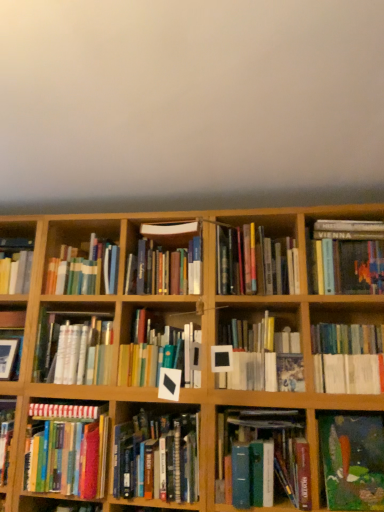
Question: Is hardcover books at center right, acting as the 2th book starting from the right, at the right side of oil painting at lower right, which is the third book in right-to-left order?

Choices:
 (A) yes
 (B) no

Answer: (A)

Question: Does hardcover books at center right, acting as the 2th book starting from the right, have a greater width compared to oil painting at lower right, the 11th book in the left-to-right sequence?

Choices:
 (A) yes
 (B) no

Answer: (A)

Question: Can you confirm if hardcover books at center right, acting as the 2th book starting from the right, is shorter than oil painting at lower right, which is the third book in right-to-left order?

Choices:
 (A) no
 (B) yes

Answer: (A)

Question: Can you confirm if hardcover books at center right, acting as the 2th book starting from the right, is taller than oil painting at lower right, which is the third book in right-to-left order?

Choices:
 (A) yes
 (B) no

Answer: (A)

Question: Considering the relative sizes of hardcover books at center right, the 12th book positioned from the left, and oil painting at lower right, which is the third book in right-to-left order, in the image provided, is hardcover books at center right, the 12th book positioned from the left, smaller than oil painting at lower right, which is the third book in right-to-left order,?

Choices:
 (A) no
 (B) yes

Answer: (A)

Question: Is hardcover books at center right, the 12th book positioned from the left, positioned before oil painting at lower right, the 11th book in the left-to-right sequence?

Choices:
 (A) no
 (B) yes

Answer: (A)

Question: Considering the relative sizes of hardcover book at center-left, the third book from the left, and white matte book at center, arranged as the fifth book when viewed from the right, in the image provided, is hardcover book at center-left, the third book from the left, smaller than white matte book at center, arranged as the fifth book when viewed from the right,?

Choices:
 (A) yes
 (B) no

Answer: (A)

Question: Considering the relative sizes of hardcover book at center-left, the third book from the left, and white matte book at center, arranged as the fifth book when viewed from the right, in the image provided, is hardcover book at center-left, the third book from the left, wider than white matte book at center, arranged as the fifth book when viewed from the right,?

Choices:
 (A) no
 (B) yes

Answer: (B)

Question: From a real-world perspective, is hardcover book at center-left, the third book from the left, located higher than white matte book at center, arranged as the fifth book when viewed from the right?

Choices:
 (A) yes
 (B) no

Answer: (B)

Question: Is hardcover book at center-left, the third book from the left, touching white matte book at center, arranged as the fifth book when viewed from the right?

Choices:
 (A) no
 (B) yes

Answer: (A)

Question: Is hardcover book at center-left, which is the eleventh book in right-to-left order, closer to camera compared to white matte book at center, the ninth book viewed from the left?

Choices:
 (A) no
 (B) yes

Answer: (A)

Question: Considering the relative sizes of hardcover book at center-left, the third book from the left, and white matte book at center, arranged as the fifth book when viewed from the right, in the image provided, is hardcover book at center-left, the third book from the left, taller than white matte book at center, arranged as the fifth book when viewed from the right,?

Choices:
 (A) yes
 (B) no

Answer: (B)

Question: Considering the relative positions of hardcover book at upper right, the first book in the right-to-left sequence, and hardcover books at center, the 6th book when ordered from right to left, in the image provided, is hardcover book at upper right, the first book in the right-to-left sequence, in front of hardcover books at center, the 6th book when ordered from right to left,?

Choices:
 (A) no
 (B) yes

Answer: (A)